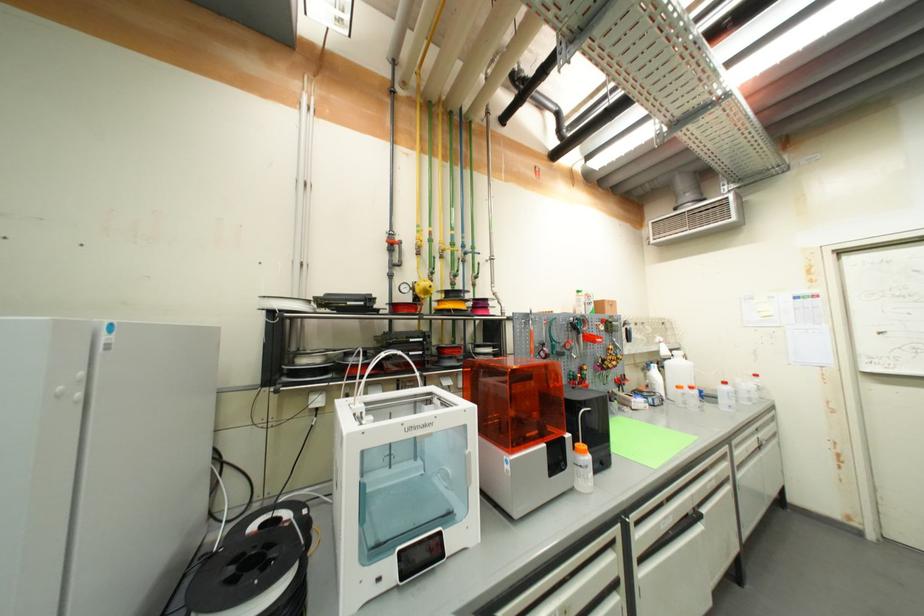
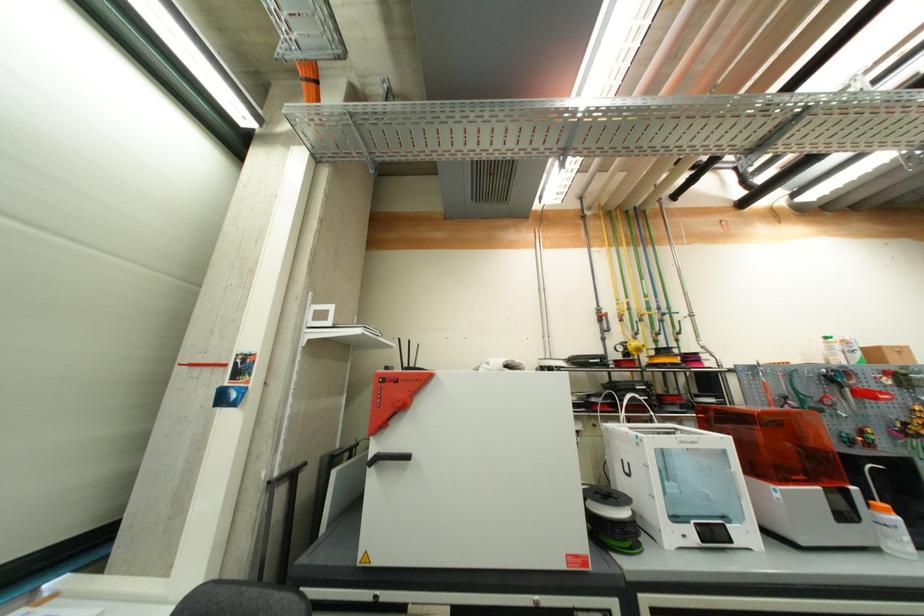
Question: How did the camera likely rotate?

Choices:
 (A) Left
 (B) Right
 (C) Up
 (D) Down

Answer: (A)